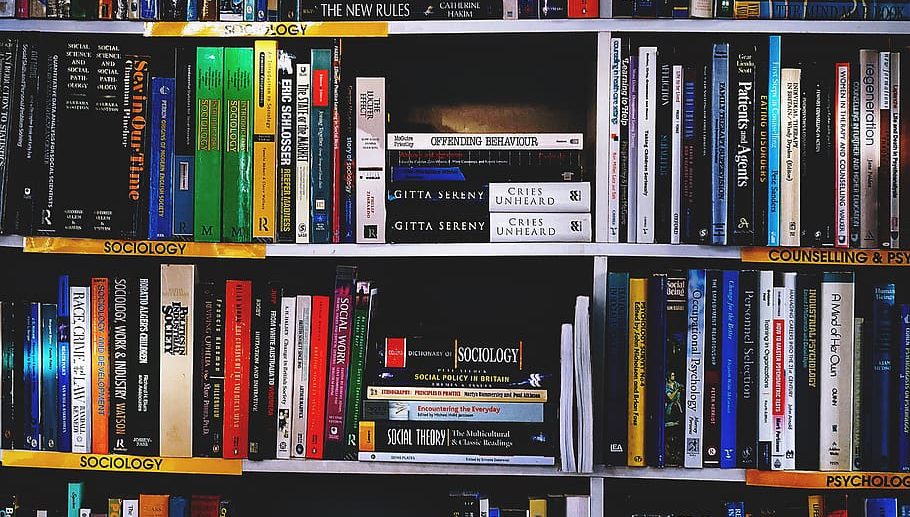
You are a GUI agent. You are given a task and a screenshot of the screen. Output one action in this format:
    pyautogui.click(x=<x>, y=<y>)
    Task: Click on the short books
    This screenshot has width=910, height=517.
    Given the screenshot: What is the action you would take?
    pyautogui.click(x=435, y=447)